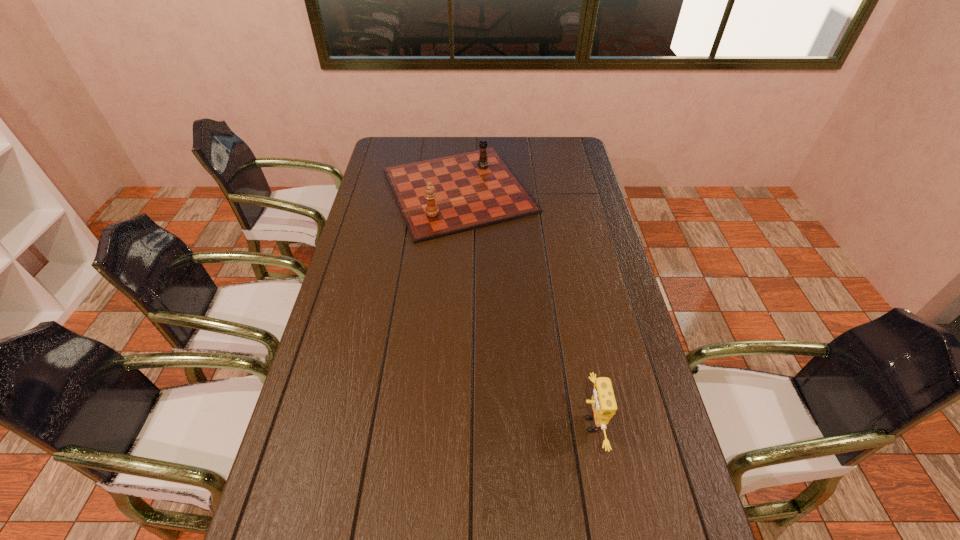
Find the location of a particular element. This screenshot has width=960, height=540. free point between the sponge and the gameboard is located at coordinates (524, 307).